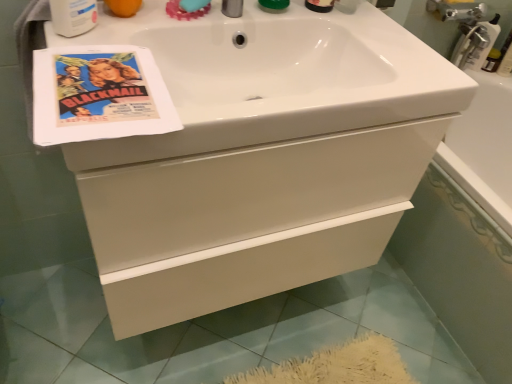
Identify the location of free space above vintage paper flyer at upper left (from a real-world perspective). This screenshot has width=512, height=384. (95, 84).